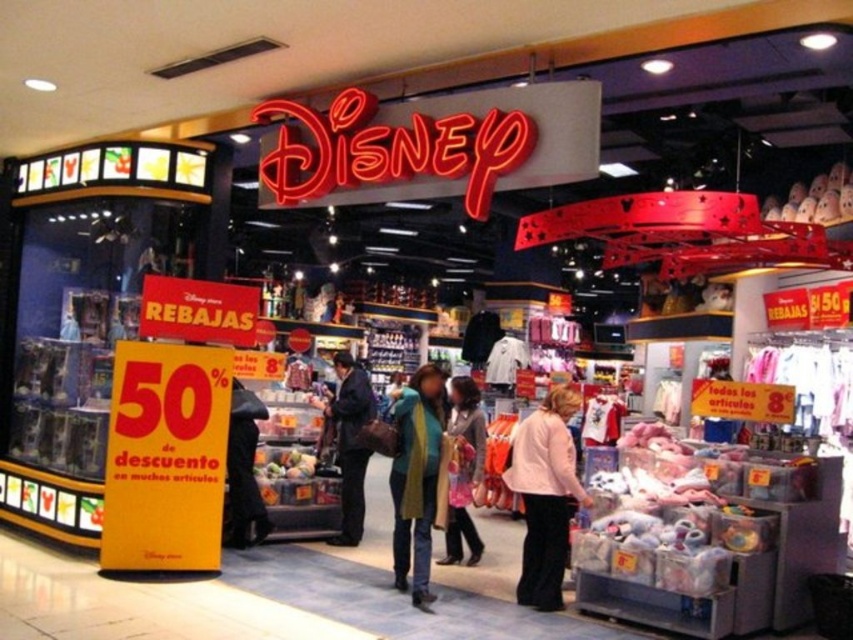
Question: Is pink fabric jacket at lower center above dark blue jeans at center?

Choices:
 (A) yes
 (B) no

Answer: (B)

Question: Does pink fabric jacket at lower center have a larger size compared to dark blue jeans at center?

Choices:
 (A) yes
 (B) no

Answer: (B)

Question: Which object appears farthest from the camera in this image?

Choices:
 (A) dark blue jeans at center
 (B) light pink fabric jacket at center
 (C) pink fabric jacket at lower center
 (D) green knitted scarf at center

Answer: (A)

Question: In this image, where is green knitted scarf at center located relative to dark blue jeans at center?

Choices:
 (A) above
 (B) below

Answer: (B)

Question: Which object is closer to the camera taking this photo?

Choices:
 (A) light pink fabric jacket at center
 (B) green knitted scarf at center

Answer: (B)

Question: Which of the following is the farthest from the observer?

Choices:
 (A) (473, 547)
 (B) (409, 476)
 (C) (517, 595)
 (D) (345, 465)

Answer: (D)